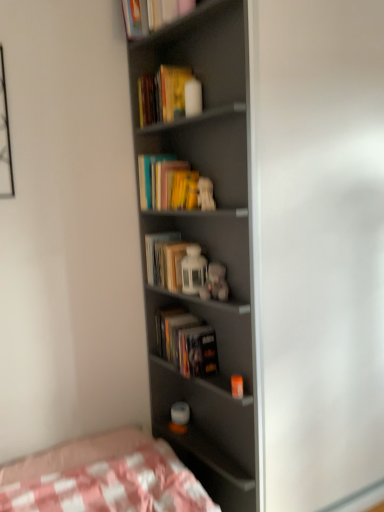
What do you see at coordinates (215, 283) in the screenshot? This screenshot has height=512, width=384. I see `fluffy white teddy bear at center, which appears as the third toy when viewed from the top` at bounding box center [215, 283].

Where is `hardcover book at center, arranged as the second paperback book when ordered from the bottom`? This screenshot has width=384, height=512. hardcover book at center, arranged as the second paperback book when ordered from the bottom is located at coordinates (174, 264).

Measure the distance between white glossy jar at center, the 2th toy positioned from the top, and camera.

white glossy jar at center, the 2th toy positioned from the top, is 5.86 feet away from camera.

Where is `matte gray screen door at center`? The width and height of the screenshot is (384, 512). matte gray screen door at center is located at coordinates (320, 250).

This screenshot has width=384, height=512. Describe the element at coordinates (320, 250) in the screenshot. I see `matte gray screen door at center` at that location.

The width and height of the screenshot is (384, 512). What are the coordinates of `fluffy white teddy bear at center, which appears as the third toy when viewed from the top` in the screenshot? It's located at (215, 283).

From the picture: From the image's perspective, relative to fluffy white teddy bear at center, which appears as the third toy when viewed from the top, is hardcover books at center, arranged as the second book when viewed from the top, above or below?

Clearly, from the image's perspective, hardcover books at center, arranged as the second book when viewed from the top, is above fluffy white teddy bear at center, which appears as the third toy when viewed from the top.

Is hardcover books at center, arranged as the second book when viewed from the top, spatially inside fluffy white teddy bear at center, which appears as the third toy when viewed from the top, or outside of it?

The correct answer is: outside.

Is hardcover books at center, which appears as the first book when viewed from the back, not near fluffy white teddy bear at center, the 1th toy from the bottom?

hardcover books at center, which appears as the first book when viewed from the back, is actually quite close to fluffy white teddy bear at center, the 1th toy from the bottom.

From the image's perspective, which is below, hardcover book at upper center, the second book from the back, or white matte figurine at center, which is the first toy in top-to-bottom order?

white matte figurine at center, which is the first toy in top-to-bottom order.

Considering the sizes of hardcover book at upper center, the 1th book viewed from the top, and white matte figurine at center, the third toy ordered from the bottom, in the image, is hardcover book at upper center, the 1th book viewed from the top, taller or shorter than white matte figurine at center, the third toy ordered from the bottom,?

Considering their sizes, hardcover book at upper center, the 1th book viewed from the top, has more height than white matte figurine at center, the third toy ordered from the bottom.

Is hardcover book at upper center, which is the 1th book in front-to-back order, aimed at white matte figurine at center, which is the first toy in top-to-bottom order?

No, hardcover book at upper center, which is the 1th book in front-to-back order, is not aimed at white matte figurine at center, which is the first toy in top-to-bottom order.

Is hardcover book at upper center, the second book from the back, wider than white matte figurine at center, the third toy ordered from the bottom?

Yes, hardcover book at upper center, the second book from the back, is wider than white matte figurine at center, the third toy ordered from the bottom.

Looking at this image, could you tell me if hardcover books at center, the 3th paperback book from the bottom, is facing white glossy jar at center, the 2th toy positioned from the top?

No, hardcover books at center, the 3th paperback book from the bottom, does not turn towards white glossy jar at center, the 2th toy positioned from the top.

Which object is further away from the camera, hardcover books at center, the 3th paperback book from the bottom, or white glossy jar at center, the second toy ordered from the bottom?

hardcover books at center, the 3th paperback book from the bottom, is further from the camera.

Is hardcover books at center, the 3th paperback book from the bottom, spatially inside white glossy jar at center, the second toy ordered from the bottom, or outside of it?

hardcover books at center, the 3th paperback book from the bottom, is spatially situated outside white glossy jar at center, the second toy ordered from the bottom.

From their relative heights in the image, would you say hardcover books at center, placed as the 2th paperback book when sorted from top to bottom, is taller or shorter than white glossy jar at center, the second toy ordered from the bottom?

In the image, hardcover books at center, placed as the 2th paperback book when sorted from top to bottom, appears to be taller than white glossy jar at center, the second toy ordered from the bottom.

Looking at the image, does hardcover book at upper center, the second book from the back, seem bigger or smaller compared to hardcover book at center, arranged as the 1th paperback book when ordered from the bottom?

In the image, hardcover book at upper center, the second book from the back, appears to be larger than hardcover book at center, arranged as the 1th paperback book when ordered from the bottom.

Identify the location of book that is the 2nd one when counting upward from the hardcover book at center, which appears as the 4th paperback book when viewed from the top (from the image's perspective). (152, 14).

In the scene shown: Can you tell me how much hardcover book at upper center, the second book from the back, and hardcover book at center, which appears as the 4th paperback book when viewed from the top, differ in facing direction?

The angle between the facing direction of hardcover book at upper center, the second book from the back, and the facing direction of hardcover book at center, which appears as the 4th paperback book when viewed from the top, is 3.49 degrees.

Is point (170, 15) positioned after point (210, 346)?

No, (170, 15) is closer to viewer.

Can you confirm if hardcover book at center, which appears as the 4th paperback book when viewed from the top, is positioned to the left of hardcover book at upper center, the 1th book viewed from the top?

In fact, hardcover book at center, which appears as the 4th paperback book when viewed from the top, is to the right of hardcover book at upper center, the 1th book viewed from the top.

Consider the image. Which is closer to the camera, (213, 346) or (143, 12)?

Point (213, 346) is farther from the camera than point (143, 12).

Between hardcover book at center, arranged as the 1th paperback book when ordered from the bottom, and hardcover book at upper center, which is the 1th book in front-to-back order, which one is positioned in front?

Positioned in front is hardcover book at upper center, which is the 1th book in front-to-back order.

Considering the sizes of objects hardcover book at center, which appears as the 4th paperback book when viewed from the top, and hardcover book at upper center, the 1th book viewed from the top, in the image provided, who is smaller, hardcover book at center, which appears as the 4th paperback book when viewed from the top, or hardcover book at upper center, the 1th book viewed from the top,?

hardcover book at center, which appears as the 4th paperback book when viewed from the top, is smaller.

Is hardcover book at center, arranged as the second paperback book when ordered from the bottom, oriented away from matte gray screen door at center?

Yes, hardcover book at center, arranged as the second paperback book when ordered from the bottom, is facing away from matte gray screen door at center.

Between hardcover book at center, which is the third paperback book from top to bottom, and matte gray screen door at center, which one is positioned in front?

Positioned in front is matte gray screen door at center.

Who is taller, hardcover book at center, arranged as the second paperback book when ordered from the bottom, or matte gray screen door at center?

Standing taller between the two is matte gray screen door at center.

Is hardcover book at center, which is the third paperback book from top to bottom, not close to matte gray screen door at center?

They are positioned close to each other.

From the image's perspective, would you say hardcover books at center, placed as the 2th paperback book when sorted from top to bottom, is shown under hardcover book at upper center, which is the 1th book in front-to-back order?

Yes, from the image's perspective, hardcover books at center, placed as the 2th paperback book when sorted from top to bottom, is below hardcover book at upper center, which is the 1th book in front-to-back order.

Considering the sizes of objects hardcover books at center, the 3th paperback book from the bottom, and hardcover book at upper center, the second book from the back, in the image provided, who is shorter, hardcover books at center, the 3th paperback book from the bottom, or hardcover book at upper center, the second book from the back,?

Standing shorter between the two is hardcover books at center, the 3th paperback book from the bottom.

Between point (145, 200) and point (146, 22), which one is positioned behind?

The point (145, 200) is behind.

Is hardcover books at center, placed as the 2th paperback book when sorted from top to bottom, oriented towards hardcover book at upper center, which is the 1th book in front-to-back order?

No, hardcover books at center, placed as the 2th paperback book when sorted from top to bottom, is not aimed at hardcover book at upper center, which is the 1th book in front-to-back order.

Find the location of `the 2nd book behind the fluffy white teddy bear at center, which appears as the third toy when viewed from the top`. the 2nd book behind the fluffy white teddy bear at center, which appears as the third toy when viewed from the top is located at coordinates (165, 260).

Locate an element on the screen. the 2nd toy counting from the right of the hardcover book at upper center, the second book from the back is located at coordinates (205, 194).

Based on their spatial positions, is white matte figurine at center, which is the first toy in top-to-bottom order, or hardcover books at center, the 3th paperback book from the bottom, closer to matte gray screen door at center?

Based on the image, white matte figurine at center, which is the first toy in top-to-bottom order, appears to be nearer to matte gray screen door at center.

Considering their positions, is hardcover books at center, arranged as the second book when viewed from the top, positioned further to hardcover book at upper center, the 4th paperback book positioned from the bottom, than fluffy white teddy bear at center, which appears as the third toy when viewed from the top?

fluffy white teddy bear at center, which appears as the third toy when viewed from the top, is further to hardcover book at upper center, the 4th paperback book positioned from the bottom.

Based on their spatial positions, is hardcover book at upper center, the 4th paperback book positioned from the bottom, or hardcover book at upper center, the 1th book viewed from the top, further from fluffy white teddy bear at center, which appears as the third toy when viewed from the top?

hardcover book at upper center, the 1th book viewed from the top, is positioned further to the anchor fluffy white teddy bear at center, which appears as the third toy when viewed from the top.

When comparing their distances from white matte figurine at center, the third toy ordered from the bottom, does hardcover book at upper center, the 4th paperback book positioned from the bottom, or hardcover book at center, which is the third paperback book from top to bottom, seem closer?

The object closer to white matte figurine at center, the third toy ordered from the bottom, is hardcover book at center, which is the third paperback book from top to bottom.

Estimate the real-world distances between objects in this image. Which object is closer to white glossy jar at center, the second toy ordered from the bottom, hardcover book at center, which appears as the 4th paperback book when viewed from the top, or matte gray bookcase at center?

hardcover book at center, which appears as the 4th paperback book when viewed from the top, is closer to white glossy jar at center, the second toy ordered from the bottom.

Looking at the image, which one is located closer to hardcover book at upper center, the 4th paperback book positioned from the bottom, hardcover book at center, arranged as the second paperback book when ordered from the bottom, or matte gray bookcase at center?

Among the two, matte gray bookcase at center is located nearer to hardcover book at upper center, the 4th paperback book positioned from the bottom.

When comparing their distances from matte gray bookcase at center, does hardcover book at center, which appears as the 4th paperback book when viewed from the top, or hardcover book at upper center, which appears as the 1th paperback book when viewed from the top, seem further?

Based on the image, hardcover book at upper center, which appears as the 1th paperback book when viewed from the top, appears to be further to matte gray bookcase at center.

From the image, which object appears to be nearer to white glossy jar at center, the 2th toy positioned from the top, hardcover book at upper center, which is the 1th book in front-to-back order, or hardcover book at center, which appears as the 4th paperback book when viewed from the top?

hardcover book at center, which appears as the 4th paperback book when viewed from the top, is closer to white glossy jar at center, the 2th toy positioned from the top.

Locate an element on the screen. The image size is (384, 512). screen door between hardcover book at upper center, which is the 1th book in front-to-back order, and hardcover book at center, arranged as the 1th paperback book when ordered from the bottom, in the up-down direction is located at coordinates (320, 250).

Where is `toy between hardcover book at upper center, which is the 1th book in front-to-back order, and white glossy jar at center, the 2th toy positioned from the top, from top to bottom`? The height and width of the screenshot is (512, 384). toy between hardcover book at upper center, which is the 1th book in front-to-back order, and white glossy jar at center, the 2th toy positioned from the top, from top to bottom is located at coordinates click(x=205, y=194).

Image resolution: width=384 pixels, height=512 pixels. I want to click on toy that lies between hardcover book at upper center, the 1th book viewed from the top, and hardcover book at center, which is the third paperback book from top to bottom, from top to bottom, so click(x=205, y=194).

This screenshot has width=384, height=512. In order to click on toy between hardcover book at upper center, which appears as the 1th paperback book when viewed from the top, and hardcover books at center, marked as the 1th book in a bottom-to-top arrangement, vertically in this screenshot , I will do `click(205, 194)`.